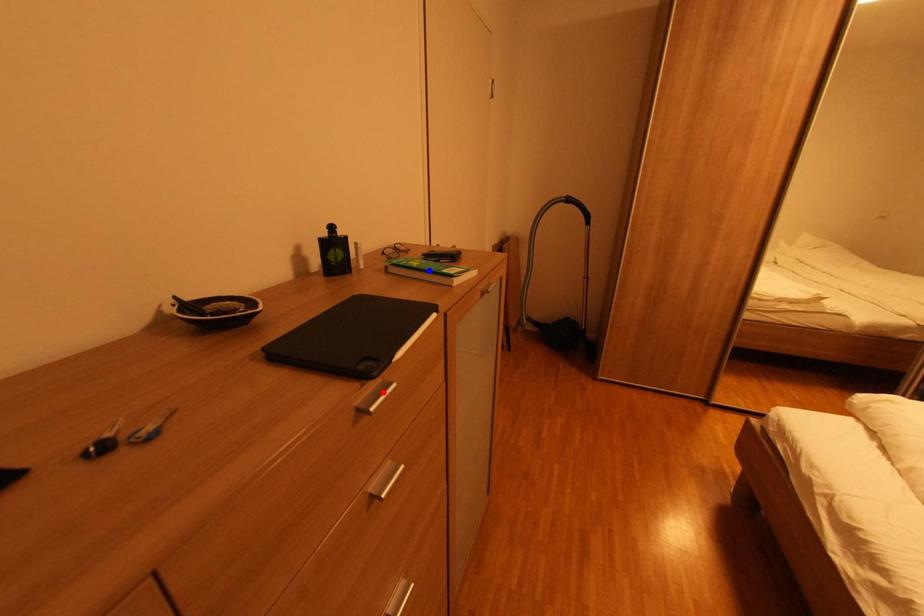
Question: Two points are marked on the image. Which point is closer to the camera?

Choices:
 (A) Blue point is closer.
 (B) Red point is closer.

Answer: (B)